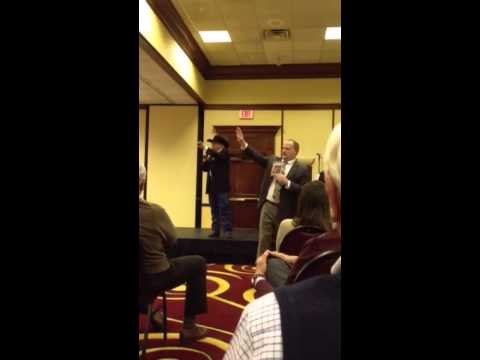
Locate an element on the screen. lights ceiling is located at coordinates (221, 30), (339, 34).